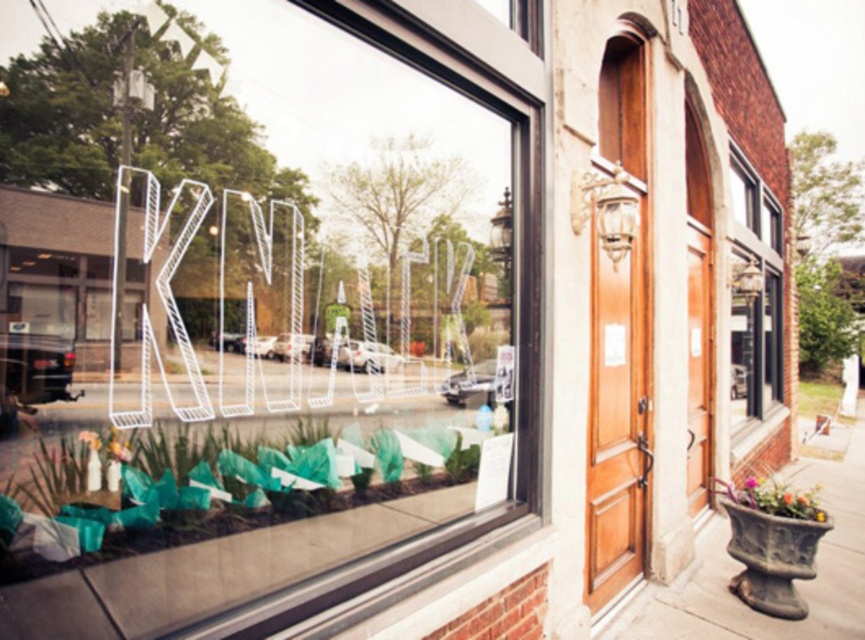
You are standing outside the building and want to see the green leafy plant at lower left through the clear glass window at upper right. Can you see the plant through the window?

The green leafy plant at lower left is in front of the clear glass window at upper right, so it would block the view of the plant through the window.

You are standing in front of the building and want to take a photo. There are two points marked on the window glass at coordinates point (785, 202) and point (746, 499). Which point is closer to your camera lens when taking the photo?

Point (746, 499) is closer to the camera lens because it is less further away than point (785, 202) according to the description.

You are standing in front of the building with the large window displaying the word KNITTY. There is a point at coordinates point (x=170, y=244) that you want to reach. Can you estimate how far you need to walk to get there?

The distance between point (x=170, y=244) and the camera is 6.52 feet, so you need to walk approximately 6.52 feet to reach it.